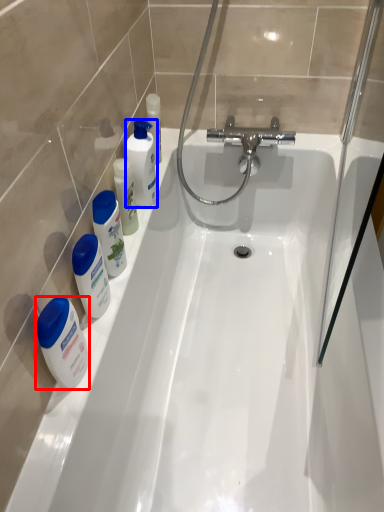
Question: Which object appears closest to the camera in this image, mouthwash (highlighted by a red box) or cleaning product (highlighted by a blue box)?

Choices:
 (A) mouthwash
 (B) cleaning product

Answer: (A)